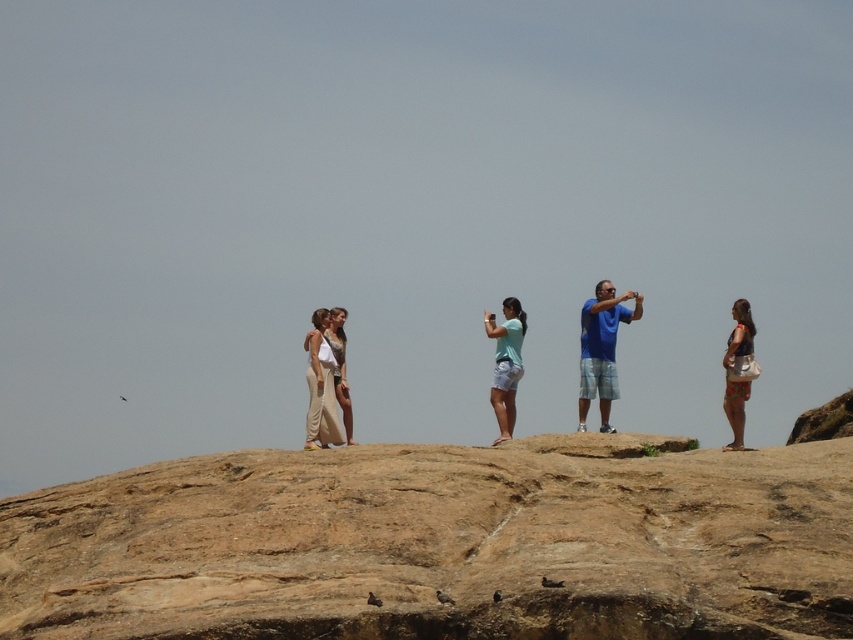
You are planning to set up a picnic blanket between the brown rock cliff at center and the beige fabric dress at center. The picnic blanket requires a minimum of 20 meters of space between the two points. Will there be enough space?

The brown rock cliff at center and beige fabric dress at center are 22.14 meters apart from each other, which is more than the required 20 meters. Therefore, there is enough space to set up the picnic blanket.

You are planning to take a photo of the blue cotton shirt at center and the floral print shorts at right. Which one should be placed higher in the frame to match their actual positions?

The blue cotton shirt at center should be placed higher in the frame because it is taller than the floral print shorts at right.